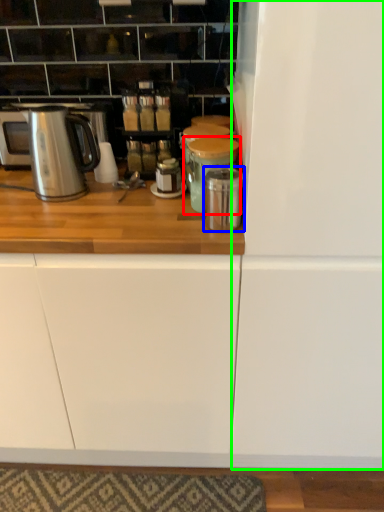
Question: Estimate the real-world distances between objects in this image. Which object is farther from appliance (highlighted by a red box), appliance (highlighted by a blue box) or fridge (highlighted by a green box)?

Choices:
 (A) appliance
 (B) fridge

Answer: (B)